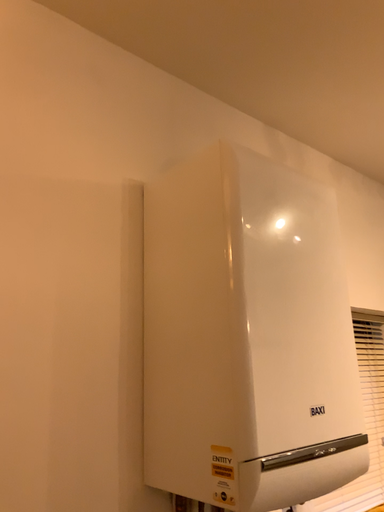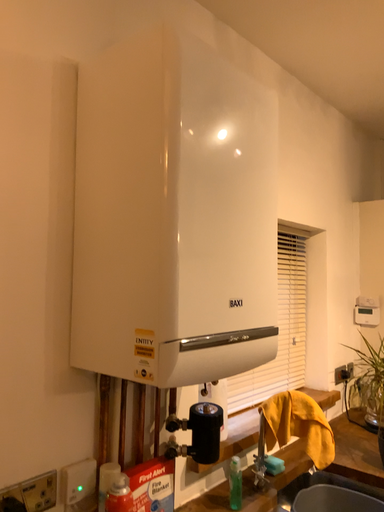
Question: Which way did the camera rotate in the video?

Choices:
 (A) rotated left
 (B) rotated right

Answer: (B)